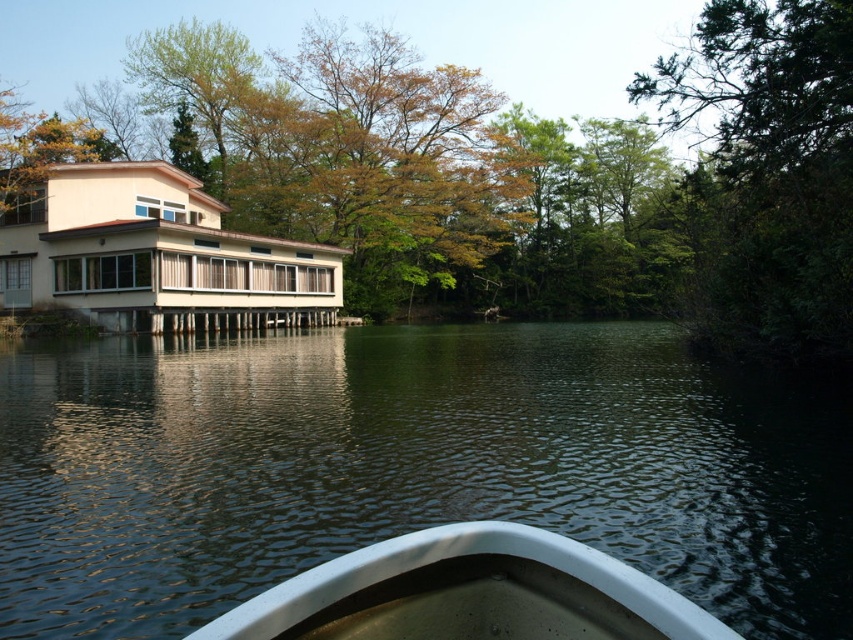
Locate an element on the screen. green leafy tree at upper center is located at coordinates (457, 186).

Between green leafy tree at upper center and yellow-green foliage at upper left, which one has less height?

yellow-green foliage at upper left

Image resolution: width=853 pixels, height=640 pixels. Describe the element at coordinates (457, 186) in the screenshot. I see `green leafy tree at upper center` at that location.

Find the location of a particular element. green leafy tree at upper center is located at coordinates (457, 186).

Can you confirm if greenish water at center is bigger than green leafy tree at upper center?

No.

Who is higher up, greenish water at center or green leafy tree at upper center?

green leafy tree at upper center

Locate an element on the screen. greenish water at center is located at coordinates (409, 467).

Between point (714, 83) and point (612, 616), which one is positioned in front?

Point (612, 616) is in front.

Between green leafy tree at upper right and white glossy boat at center, which one appears on the right side from the viewer's perspective?

green leafy tree at upper right

Does point (691, 214) lie in front of point (434, 609)?

No.

Image resolution: width=853 pixels, height=640 pixels. In order to click on green leafy tree at upper right in this screenshot , I will do `click(769, 173)`.